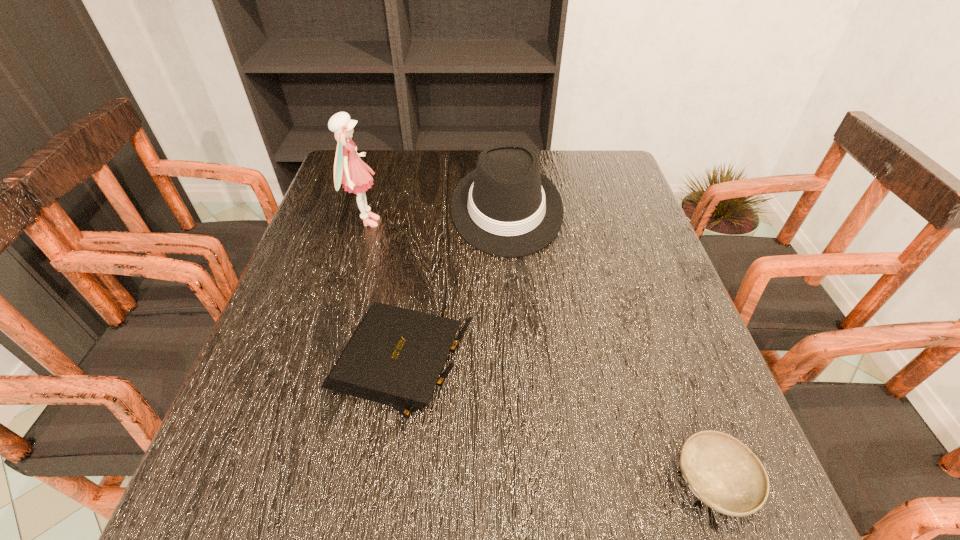
Where is `doll`? Image resolution: width=960 pixels, height=540 pixels. doll is located at coordinates coord(349,170).

Where is `the second tallest object`? The image size is (960, 540). the second tallest object is located at coordinates (506, 207).

Where is `router`? Image resolution: width=960 pixels, height=540 pixels. router is located at coordinates (395, 356).

Image resolution: width=960 pixels, height=540 pixels. I want to click on the third farthest object, so click(x=395, y=356).

You are a GUI agent. You are given a task and a screenshot of the screen. Output one action in this format:
    pyautogui.click(x=<x>, y=<y>)
    Task: Click on the bowl
    This screenshot has height=540, width=960.
    Given the screenshot: What is the action you would take?
    pyautogui.click(x=722, y=472)

Identify the location of the nearest object. This screenshot has width=960, height=540. [722, 472].

I want to click on vacant area situated on the front-facing side of the tallest object, so click(x=461, y=222).

Locate an element on the screen. The image size is (960, 540). free space located on the front-facing side of the fedora is located at coordinates pos(519,381).

You are a GUI agent. You are given a task and a screenshot of the screen. Output one action in this format:
    pyautogui.click(x=<x>, y=<y>)
    Task: Click on the vacant area located 0.160m on the right of the third tallest object
    
    Given the screenshot: What is the action you would take?
    pyautogui.click(x=560, y=369)

Locate an element on the screen. This screenshot has height=540, width=960. free location located on the left of the rightmost object is located at coordinates (601, 482).